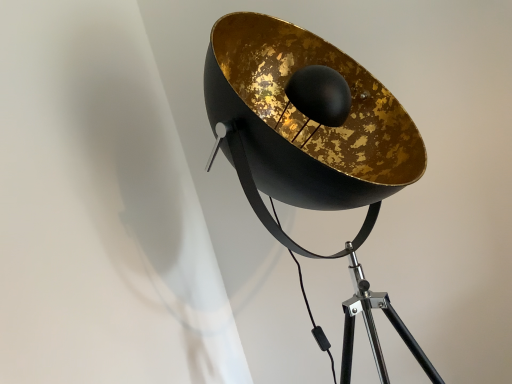
The image size is (512, 384). I want to click on matte black tripod lamp at center, so click(x=311, y=142).

The image size is (512, 384). What do you see at coordinates (311, 142) in the screenshot?
I see `matte black tripod lamp at center` at bounding box center [311, 142].

Locate an element on the screen. matte black tripod lamp at center is located at coordinates (311, 142).